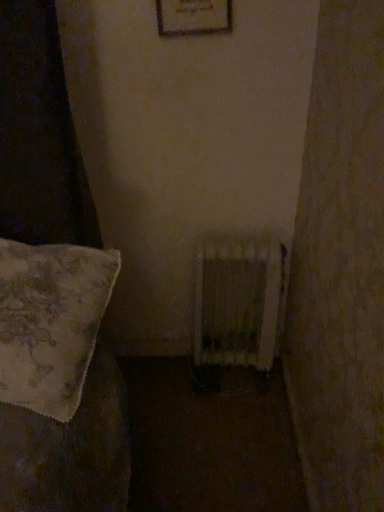
Question: Is wooden framed picture at upper center taller than floral fabric pillow at left?

Choices:
 (A) no
 (B) yes

Answer: (B)

Question: From the image's perspective, is wooden framed picture at upper center on top of floral fabric pillow at left?

Choices:
 (A) yes
 (B) no

Answer: (A)

Question: Is wooden framed picture at upper center completely or partially outside of floral fabric pillow at left?

Choices:
 (A) yes
 (B) no

Answer: (A)

Question: Is wooden framed picture at upper center shorter than floral fabric pillow at left?

Choices:
 (A) yes
 (B) no

Answer: (B)

Question: Is wooden framed picture at upper center far away from floral fabric pillow at left?

Choices:
 (A) yes
 (B) no

Answer: (B)

Question: In terms of width, does wooden radiator at center look wider or thinner when compared to wooden framed picture at upper center?

Choices:
 (A) thin
 (B) wide

Answer: (B)

Question: Considering the positions of wooden radiator at center and wooden framed picture at upper center in the image, is wooden radiator at center taller or shorter than wooden framed picture at upper center?

Choices:
 (A) short
 (B) tall

Answer: (B)

Question: Considering their positions, is wooden radiator at center located in front of or behind wooden framed picture at upper center?

Choices:
 (A) behind
 (B) front

Answer: (A)

Question: From the image's perspective, is wooden radiator at center located above or below wooden framed picture at upper center?

Choices:
 (A) below
 (B) above

Answer: (A)

Question: Relative to wooden radiator at center, is floral fabric pillow at left in front or behind?

Choices:
 (A) behind
 (B) front

Answer: (B)

Question: From the image's perspective, relative to wooden radiator at center, is floral fabric pillow at left above or below?

Choices:
 (A) above
 (B) below

Answer: (A)

Question: From a real-world perspective, relative to wooden radiator at center, is floral fabric pillow at left vertically above or below?

Choices:
 (A) above
 (B) below

Answer: (A)

Question: Is floral fabric pillow at left wider or thinner than wooden radiator at center?

Choices:
 (A) wide
 (B) thin

Answer: (A)

Question: Is point (205, 4) closer or farther from the camera than point (36, 324)?

Choices:
 (A) closer
 (B) farther

Answer: (B)

Question: From the image's perspective, relative to floral fabric pillow at left, is wooden framed picture at upper center above or below?

Choices:
 (A) above
 (B) below

Answer: (A)